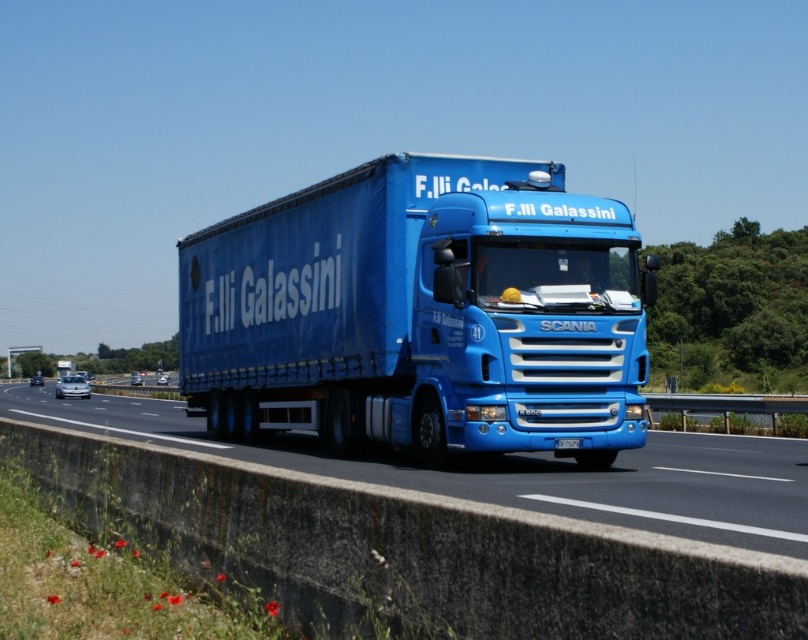
Question: Is the position of blue matte trailer truck at center more distant than that of blue metallic truck at center?

Choices:
 (A) yes
 (B) no

Answer: (A)

Question: Among these objects, which one is farthest from the camera?

Choices:
 (A) blue metallic truck at center
 (B) blue metallic license plate at center

Answer: (B)

Question: Which object is positioned farthest from the blue metallic license plate at center?

Choices:
 (A) blue matte trailer truck at center
 (B) blue metallic truck at center

Answer: (B)

Question: Can you confirm if blue matte trailer truck at center is positioned to the right of blue metallic truck at center?

Choices:
 (A) yes
 (B) no

Answer: (A)

Question: Is blue matte trailer truck at center positioned at the back of blue metallic truck at center?

Choices:
 (A) no
 (B) yes

Answer: (B)

Question: Which object appears closest to the camera in this image?

Choices:
 (A) blue metallic truck at center
 (B) blue metallic license plate at center
 (C) blue matte trailer truck at center

Answer: (A)